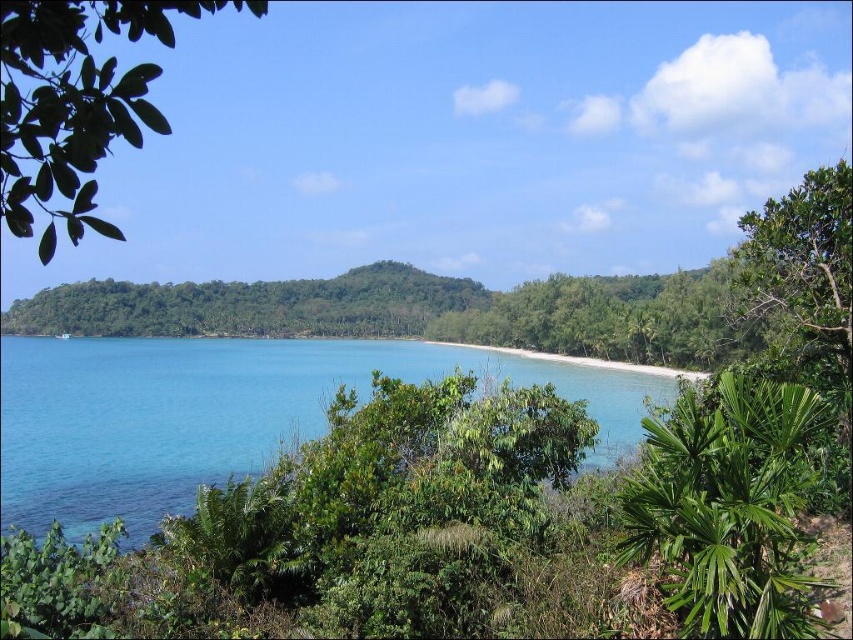
Question: Which object is closer to the camera taking this photo?

Choices:
 (A) green leafy tree at center
 (B) green leafy tree at upper left
 (C) clear blue water at center
 (D) white sand beach at center

Answer: (B)

Question: Does clear blue water at center have a lesser width compared to green leafy tree at center?

Choices:
 (A) no
 (B) yes

Answer: (A)

Question: Can you confirm if green leafy tree at upper left is thinner than green leafy tree at upper right?

Choices:
 (A) yes
 (B) no

Answer: (B)

Question: Which object is positioned closest to the green leafy tree at center?

Choices:
 (A) green leafy tree at upper left
 (B) clear blue water at center

Answer: (B)

Question: Which point is closer to the camera?

Choices:
 (A) clear blue water at center
 (B) green leafy tree at center
 (C) green leafy tree at upper right
 (D) white sand beach at center

Answer: (C)

Question: Does green leafy tree at center have a smaller size compared to green leafy tree at upper right?

Choices:
 (A) yes
 (B) no

Answer: (B)